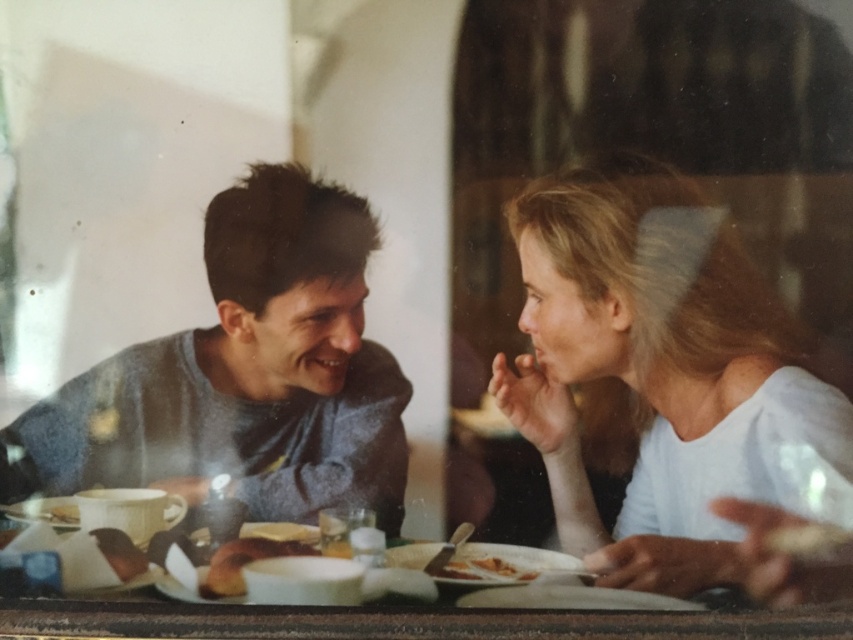
Question: Is matte gray sweater at center wider than golden crispy pastry at lower center?

Choices:
 (A) yes
 (B) no

Answer: (A)

Question: Does white matte shirt at upper right have a greater width compared to gray cotton sweater at left?

Choices:
 (A) no
 (B) yes

Answer: (A)

Question: Which of these objects is positioned farthest from the wooden table at center?

Choices:
 (A) white matte shirt at upper right
 (B) gray cotton sweater at left
 (C) brown crumbly bread at center
 (D) golden crispy pastry at lower center

Answer: (B)

Question: Is matte gray sweater at center below wooden table at center?

Choices:
 (A) yes
 (B) no

Answer: (B)

Question: Which object is the closest to the wooden table at center?

Choices:
 (A) brown crumbly bread at center
 (B) golden crispy pastry at lower center

Answer: (A)

Question: Considering the real-world distances, which object is farthest from the gray cotton sweater at left?

Choices:
 (A) brown crumbly bread at center
 (B) wooden table at center
 (C) white matte shirt at upper right
 (D) matte gray sweater at center

Answer: (C)